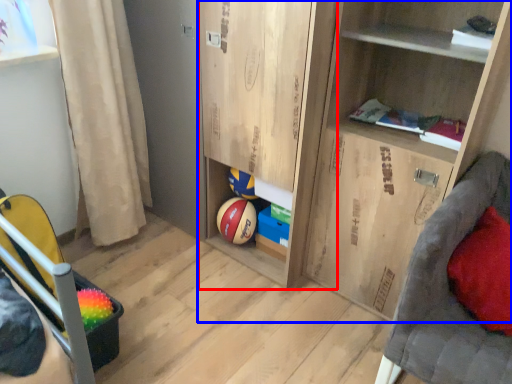
Question: Which object is closer to the camera taking this photo, cabinet (highlighted by a red box) or cupboard (highlighted by a blue box)?

Choices:
 (A) cabinet
 (B) cupboard

Answer: (B)